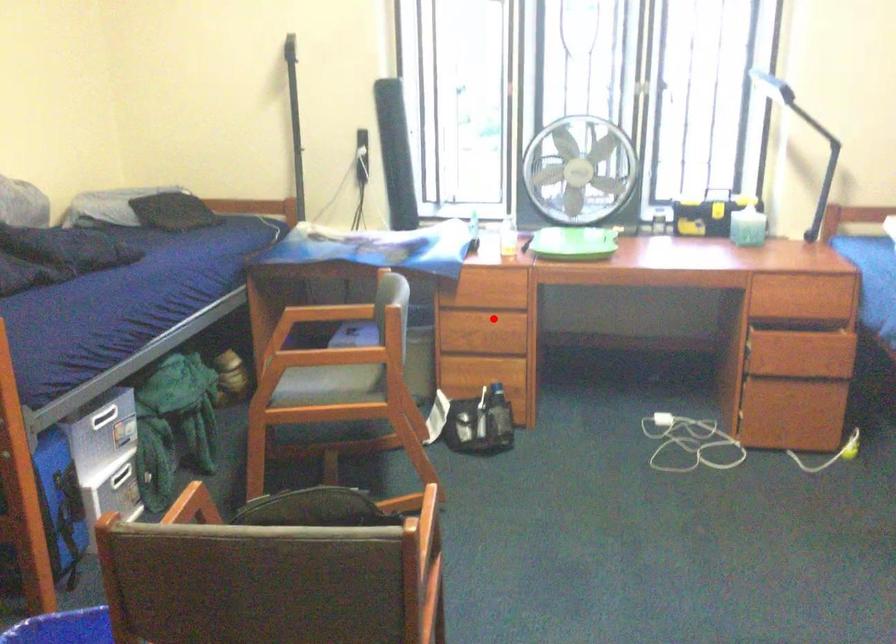
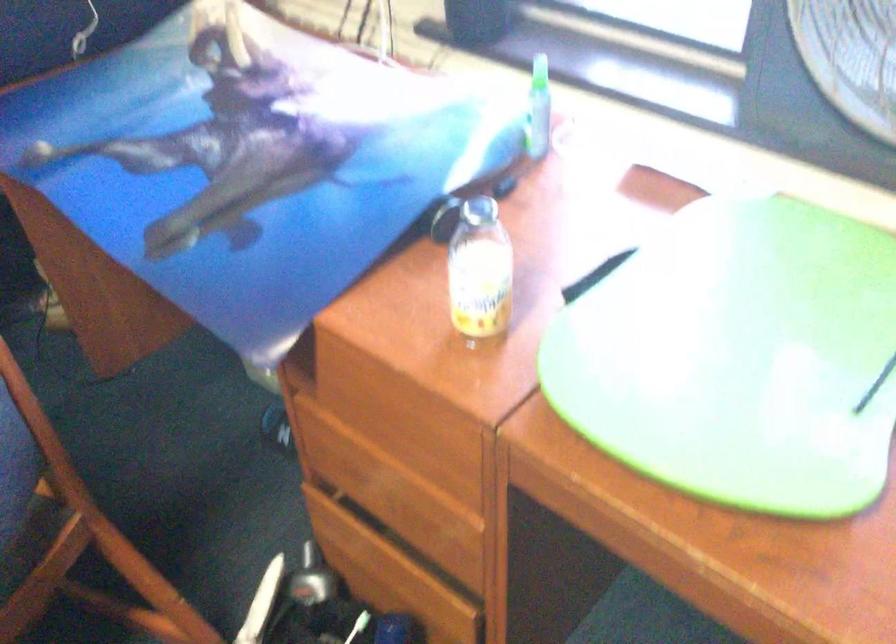
Question: I am providing you with two images of the same scene from different viewpoints. Image1 has a red point marked. In image2, the corresponding 3D location appears at what relative position? Reply with the corresponding letter.

Choices:
 (A) Closer
 (B) Farther

Answer: (A)